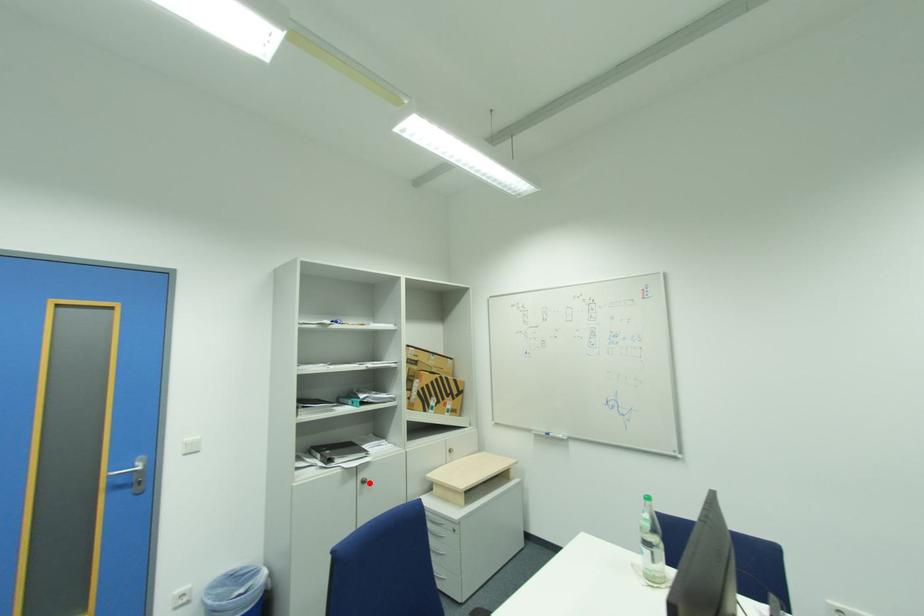
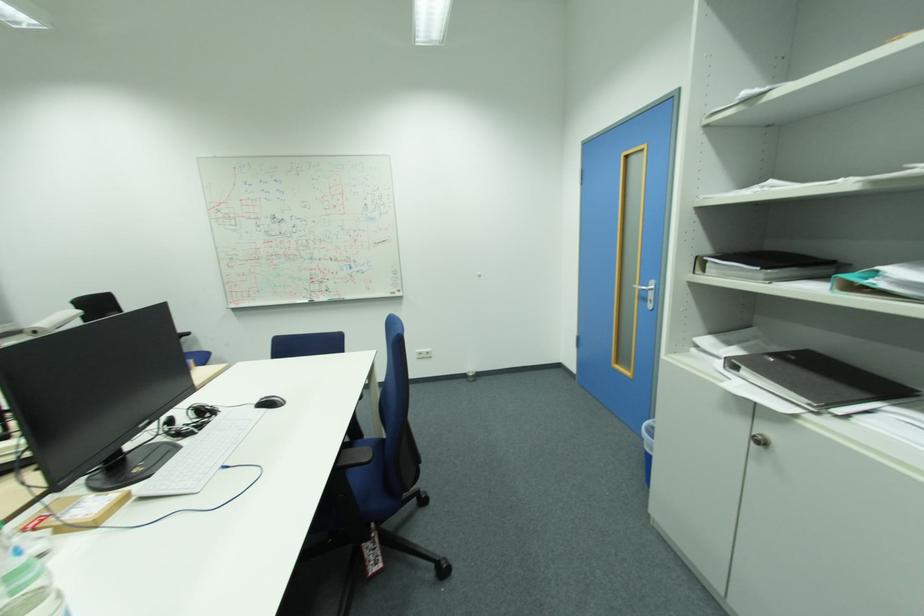
Question: I am providing you with two images of the same scene from different viewpoints. Given a red point in image1, look at the same physical point in image2. Is it:

Choices:
 (A) Closer to the viewpoint
 (B) Farther from the viewpoint

Answer: (A)